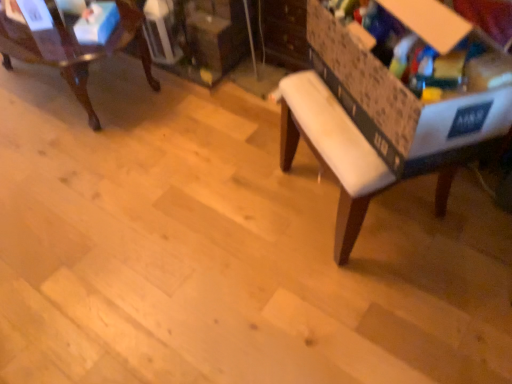
Identify the location of cardboard storage box at right, the first storage box viewed from the front. Image resolution: width=512 pixels, height=384 pixels. (418, 86).

Describe the element at coordinates (418, 86) in the screenshot. I see `cardboard storage box at right, positioned as the 2th storage box in left-to-right order` at that location.

Describe the element at coordinates (71, 38) in the screenshot. I see `mahogany wood chair at upper left` at that location.

The image size is (512, 384). Find the location of `mahogany wood chair at upper left`. mahogany wood chair at upper left is located at coordinates (71, 38).

At what (x,y) coordinates should I click in order to perform the action: click on cardboard storage box at right, which appears as the 2th storage box when viewed from the back. Please return your answer as a coordinate pair (x, y). This screenshot has width=512, height=384. Looking at the image, I should click on (418, 86).

Consider the image. Can you confirm if mahogany wood chair at upper left is wider than cardboard storage box at right, which appears as the 2th storage box when viewed from the back?

Yes.

From the picture: Is mahogany wood chair at upper left not near cardboard storage box at right, the first storage box viewed from the front?

Yes.

From a real-world perspective, is mahogany wood chair at upper left physically above cardboard storage box at right, the first storage box viewed from the front?

No, from a real-world perspective, mahogany wood chair at upper left is not on top of cardboard storage box at right, the first storage box viewed from the front.

Would you say mahogany wood chair at upper left is inside or outside cardboard storage box at right, the first storage box viewed from the front?

mahogany wood chair at upper left is not enclosed by cardboard storage box at right, the first storage box viewed from the front.

Between cardboard storage box at right, positioned as the 2th storage box in left-to-right order, and mahogany wood chair at upper left, which one has larger width?

Wider between the two is mahogany wood chair at upper left.

From the image's perspective, which object appears higher, cardboard storage box at right, positioned as the first storage box in right-to-left order, or mahogany wood chair at upper left?

mahogany wood chair at upper left.

Which storage box is the 2nd one when counting from the right side of the mahogany wood chair at upper left? Please provide its 2D coordinates.

[(418, 86)]

Looking at this image, is cardboard storage box at right, positioned as the first storage box in right-to-left order, not near mahogany wood chair at upper left?

Yes.

From a real-world perspective, is blue cardboard box at upper left, which is counted as the first storage box, starting from the back, positioned over mahogany wood chair at upper left based on gravity?

Yes.

Is blue cardboard box at upper left, the 2th storage box from the right, closer to camera compared to mahogany wood chair at upper left?

That is False.

Identify the location of chair that is under the blue cardboard box at upper left, which is the 2th storage box in front-to-back order (from a real-world perspective). (71, 38).

Is there a large distance between blue cardboard box at upper left, which is the 2th storage box in front-to-back order, and mahogany wood chair at upper left?

No, blue cardboard box at upper left, which is the 2th storage box in front-to-back order, is not far away from mahogany wood chair at upper left.

From a real-world perspective, is blue cardboard box at upper left, which is counted as the first storage box, starting from the back, positioned under white fabric bench at center based on gravity?

Yes, from a real-world perspective, blue cardboard box at upper left, which is counted as the first storage box, starting from the back, is below white fabric bench at center.

Which object is further away from the camera, blue cardboard box at upper left, arranged as the 1th storage box when viewed from the left, or white fabric bench at center?

blue cardboard box at upper left, arranged as the 1th storage box when viewed from the left, is behind.

Is blue cardboard box at upper left, which is the 2th storage box in front-to-back order, looking in the opposite direction of white fabric bench at center?

No.

Is point (86, 29) behind point (372, 159)?

Yes, it is.

From the image's perspective, is mahogany wood chair at upper left over blue cardboard box at upper left, which is the 2th storage box in front-to-back order?

Yes, from the image's perspective, mahogany wood chair at upper left is above blue cardboard box at upper left, which is the 2th storage box in front-to-back order.

Does point (6, 1) appear closer or farther from the camera than point (87, 23)?

Point (6, 1).

Which object is further away from the camera, mahogany wood chair at upper left or blue cardboard box at upper left, which is the 2th storage box in front-to-back order?

blue cardboard box at upper left, which is the 2th storage box in front-to-back order, is more distant.

Based on the photo, would you say mahogany wood chair at upper left is to the left or to the right of blue cardboard box at upper left, which is the 2th storage box in front-to-back order, in the picture?

mahogany wood chair at upper left is positioned on blue cardboard box at upper left, which is the 2th storage box in front-to-back order,'s left side.

In the scene shown: Which of these two, white fabric bench at center or blue cardboard box at upper left, which is counted as the first storage box, starting from the back, is smaller?

blue cardboard box at upper left, which is counted as the first storage box, starting from the back.

Which object is wider, white fabric bench at center or blue cardboard box at upper left, arranged as the 1th storage box when viewed from the left?

With larger width is white fabric bench at center.

In the scene shown: How different are the orientations of white fabric bench at center and blue cardboard box at upper left, the 2th storage box from the right, in degrees?

60.1 degrees separate the facing orientations of white fabric bench at center and blue cardboard box at upper left, the 2th storage box from the right.

Between white fabric bench at center and blue cardboard box at upper left, which is counted as the first storage box, starting from the back, which one is positioned behind?

blue cardboard box at upper left, which is counted as the first storage box, starting from the back.

From a real-world perspective, is cardboard storage box at right, positioned as the 2th storage box in left-to-right order, positioned over blue cardboard box at upper left, which is counted as the first storage box, starting from the back, based on gravity?

Indeed, from a real-world perspective, cardboard storage box at right, positioned as the 2th storage box in left-to-right order, stands above blue cardboard box at upper left, which is counted as the first storage box, starting from the back.

Which is nearer, (501, 108) or (114, 23)?

Clearly, point (501, 108) is closer to the camera than point (114, 23).

Looking at this image, from the image's perspective, is cardboard storage box at right, which appears as the 2th storage box when viewed from the back, located above or below blue cardboard box at upper left, which is the 2th storage box in front-to-back order?

From the image's perspective, cardboard storage box at right, which appears as the 2th storage box when viewed from the back, appears below blue cardboard box at upper left, which is the 2th storage box in front-to-back order.

From the picture: Based on their positions, is cardboard storage box at right, positioned as the 2th storage box in left-to-right order, located to the left or right of blue cardboard box at upper left, arranged as the 1th storage box when viewed from the left?

In the image, cardboard storage box at right, positioned as the 2th storage box in left-to-right order, appears on the right side of blue cardboard box at upper left, arranged as the 1th storage box when viewed from the left.

You are a GUI agent. You are given a task and a screenshot of the screen. Output one action in this format:
    pyautogui.click(x=<x>, y=<y>)
    Task: Click on the 2nd storage box positioned above the mahogany wood chair at upper left (from a real-world perspective)
    The image size is (512, 384).
    Given the screenshot: What is the action you would take?
    pyautogui.click(x=418, y=86)

Find the location of a particular element. The width and height of the screenshot is (512, 384). chair above the cardboard storage box at right, positioned as the first storage box in right-to-left order (from the image's perspective) is located at coordinates (71, 38).

From the image, which object appears to be farther from blue cardboard box at upper left, which is the 2th storage box in front-to-back order, white fabric bench at center or cardboard storage box at right, positioned as the first storage box in right-to-left order?

cardboard storage box at right, positioned as the first storage box in right-to-left order, is positioned further to the anchor blue cardboard box at upper left, which is the 2th storage box in front-to-back order.

From the image, which object appears to be farther from cardboard storage box at right, positioned as the 2th storage box in left-to-right order, mahogany wood chair at upper left or white fabric bench at center?

mahogany wood chair at upper left is positioned further to the anchor cardboard storage box at right, positioned as the 2th storage box in left-to-right order.

When comparing their distances from white fabric bench at center, does cardboard storage box at right, which appears as the 2th storage box when viewed from the back, or blue cardboard box at upper left, which is the 2th storage box in front-to-back order, seem further?

blue cardboard box at upper left, which is the 2th storage box in front-to-back order, is positioned further to the anchor white fabric bench at center.

Which object lies nearer to the anchor point white fabric bench at center, mahogany wood chair at upper left or blue cardboard box at upper left, arranged as the 1th storage box when viewed from the left?

The object closer to white fabric bench at center is blue cardboard box at upper left, arranged as the 1th storage box when viewed from the left.

Looking at the image, which one is located further to blue cardboard box at upper left, which is counted as the first storage box, starting from the back, mahogany wood chair at upper left or cardboard storage box at right, positioned as the first storage box in right-to-left order?

cardboard storage box at right, positioned as the first storage box in right-to-left order.

Looking at the image, which one is located closer to cardboard storage box at right, the first storage box viewed from the front, blue cardboard box at upper left, which is counted as the first storage box, starting from the back, or white fabric bench at center?

white fabric bench at center.

Estimate the real-world distances between objects in this image. Which object is further from blue cardboard box at upper left, which is the 2th storage box in front-to-back order, mahogany wood chair at upper left or white fabric bench at center?

white fabric bench at center is further to blue cardboard box at upper left, which is the 2th storage box in front-to-back order.

When comparing their distances from cardboard storage box at right, the first storage box viewed from the front, does white fabric bench at center or blue cardboard box at upper left, the 2th storage box from the right, seem further?

blue cardboard box at upper left, the 2th storage box from the right.

Identify the location of storage box situated between blue cardboard box at upper left, the 2th storage box from the right, and white fabric bench at center from left to right. (418, 86).

At what (x,y) coordinates should I click in order to perform the action: click on storage box between mahogany wood chair at upper left and cardboard storage box at right, the first storage box viewed from the front, from left to right. Please return your answer as a coordinate pair (x, y). The image size is (512, 384). Looking at the image, I should click on (97, 23).